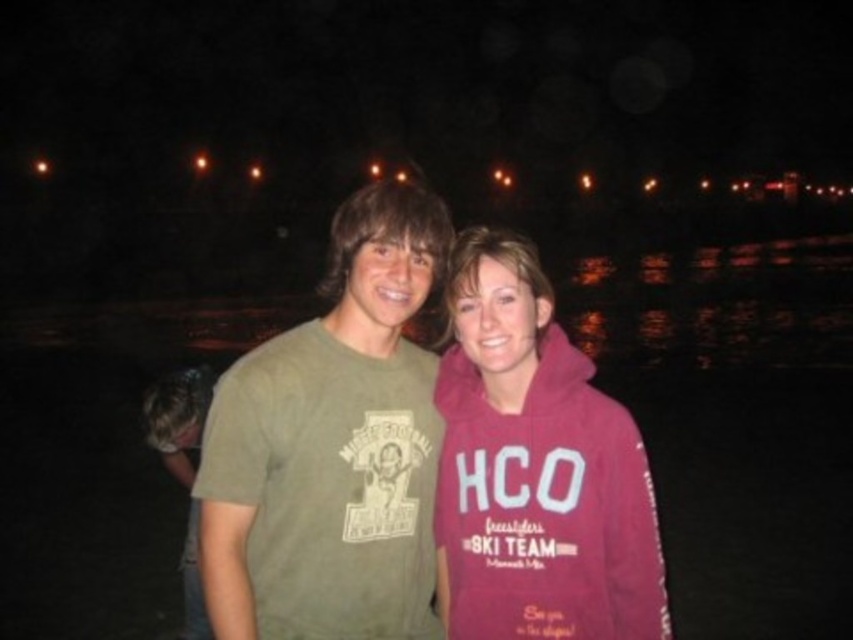
You are a photographer trying to capture the perfect shot of the scene. The green cotton t shirt at center is represented by point (332,445). Where should you position your camera to ensure the green cotton t shirt at center is in focus while also capturing the maroon hoodie with HCO on the right?

To ensure the green cotton t shirt at center is in focus and capture the maroon hoodie with HCO on the right, position the camera so that the focal point aligns with point (332,445) where the green cotton t shirt at center is located. This will keep the main subject sharp while the maroon hoodie with HCO on the right remains in the frame.